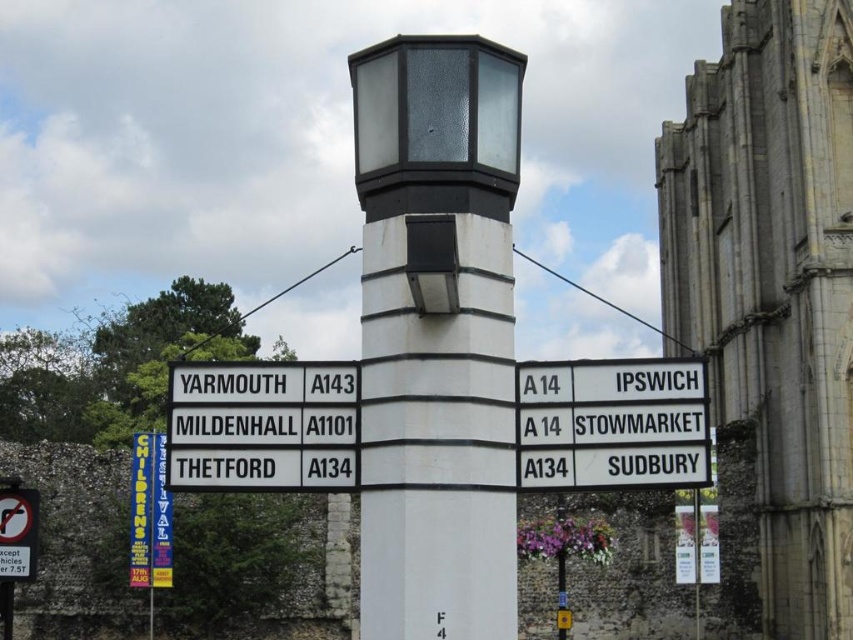
Is point (614, 378) farther from viewer compared to point (4, 531)?

No, (614, 378) is closer to viewer.

Does white plastic sign at center right have a greater height compared to black plastic sign at lower left?

Yes.

Identify the location of white plastic sign at center right. Image resolution: width=853 pixels, height=640 pixels. (612, 422).

Does blue fabric banner at lower left appear on the right side of black plastic sign at lower left?

Incorrect, blue fabric banner at lower left is not on the right side of black plastic sign at lower left.

Who is more forward, (x=149, y=536) or (x=33, y=561)?

Positioned in front is point (x=33, y=561).

What do you see at coordinates (149, 513) in the screenshot?
I see `blue fabric banner at lower left` at bounding box center [149, 513].

This screenshot has width=853, height=640. In order to click on blue fabric banner at lower left in this screenshot , I will do `click(149, 513)`.

Who is positioned more to the right, white plastic sign at center right or white plastic sign at left?

From the viewer's perspective, white plastic sign at center right appears more on the right side.

Does white plastic sign at center right have a smaller size compared to white plastic sign at left?

No.

Who is more forward, (x=564, y=385) or (x=305, y=397)?

Point (x=564, y=385) is in front.

The height and width of the screenshot is (640, 853). Find the location of `white plastic sign at center right`. white plastic sign at center right is located at coordinates (612, 422).